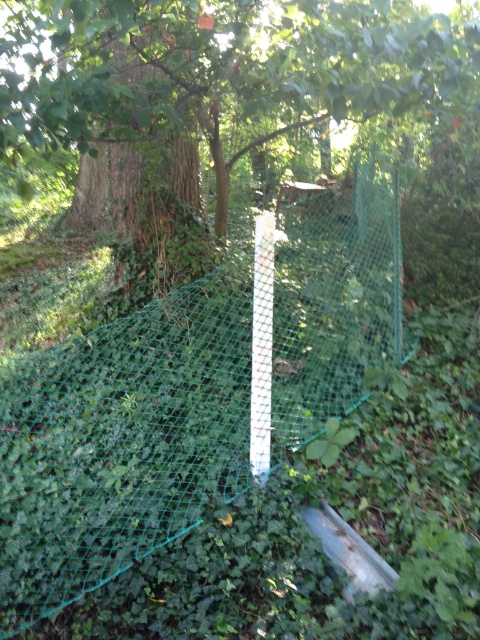
Is green mesh net at center shorter than green mesh fence at center?

No.

Which is more to the left, green mesh net at center or green mesh fence at center?

green mesh fence at center is more to the left.

Which is behind, point (24, 552) or point (424, 17)?

Point (424, 17)

Image resolution: width=480 pixels, height=640 pixels. What are the coordinates of `green mesh net at center` in the screenshot? It's located at pos(121,440).

In the scene shown: Does green mesh fence at center appear over white plastic pole at center?

Yes.

Is point (231, 1) closer to viewer compared to point (261, 476)?

No, it is behind (261, 476).

The width and height of the screenshot is (480, 640). I want to click on green mesh fence at center, so click(219, 68).

Does green mesh net at center appear under white plastic pole at center?

No, green mesh net at center is not below white plastic pole at center.

Between green mesh net at center and white plastic pole at center, which one has more height?

Standing taller between the two is green mesh net at center.

Is point (27, 490) behind point (264, 417)?

That is True.

Locate an element on the screen. The width and height of the screenshot is (480, 640). green mesh net at center is located at coordinates (121, 440).